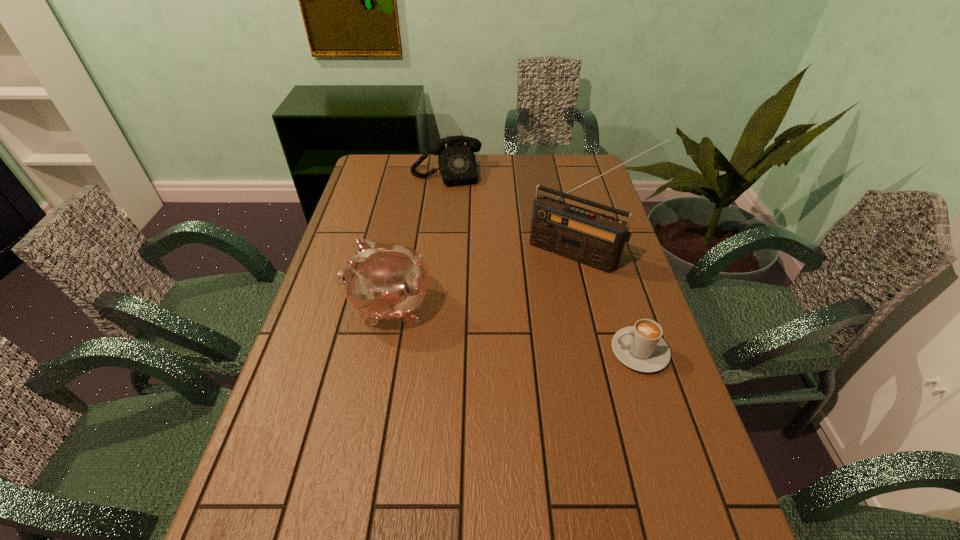
The height and width of the screenshot is (540, 960). In order to click on free spot located on the dial of the second shortest object in this screenshot , I will do `click(457, 221)`.

At what (x,y) coordinates should I click in order to perform the action: click on vacant space located on the dial of the second shortest object. Please return your answer as a coordinate pair (x, y). This screenshot has height=540, width=960. Looking at the image, I should click on (452, 195).

I want to click on free space located 0.320m on the dial of the second shortest object, so click(462, 241).

You are a GUI agent. You are given a task and a screenshot of the screen. Output one action in this format:
    pyautogui.click(x=<x>, y=<y>)
    Task: Click on the free space located 0.240m on the front-facing side of the radio receiver
    This screenshot has height=540, width=960.
    Given the screenshot: What is the action you would take?
    pyautogui.click(x=520, y=323)

Where is `vacant space located 0.090m on the front-facing side of the radio receiver`? This screenshot has height=540, width=960. vacant space located 0.090m on the front-facing side of the radio receiver is located at coordinates pyautogui.click(x=544, y=288).

The width and height of the screenshot is (960, 540). I want to click on vacant space situated on the front-facing side of the radio receiver, so 514,333.

This screenshot has height=540, width=960. I want to click on object at the far edge, so click(x=457, y=163).

Find the location of a particular element. object that is at the left edge is located at coordinates (382, 281).

You are a GUI agent. You are given a task and a screenshot of the screen. Output one action in this format:
    pyautogui.click(x=<x>, y=<y>)
    Task: Click on the cappuccino present at the right edge
    This screenshot has width=960, height=540.
    Given the screenshot: What is the action you would take?
    pyautogui.click(x=640, y=347)

Where is `radio receiver situated at the right edge`? This screenshot has width=960, height=540. radio receiver situated at the right edge is located at coordinates (590, 238).